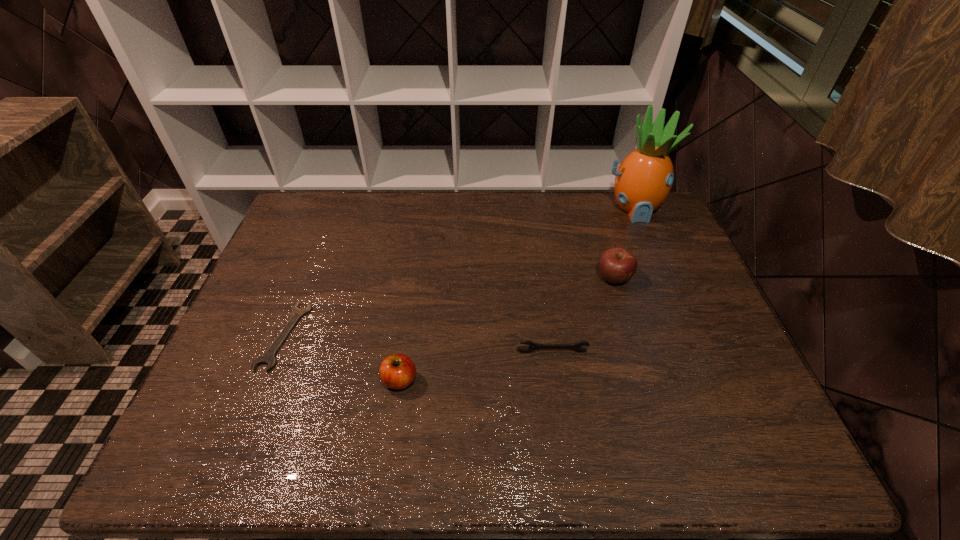
Image resolution: width=960 pixels, height=540 pixels. I want to click on vacant area between the third object from left to right and the second object from left to right, so click(476, 366).

This screenshot has height=540, width=960. What are the coordinates of `vacant space that is in between the farthest object and the second shortest object` in the screenshot? It's located at (592, 280).

Identify the location of blank region between the second shortest object and the farthest object. The image size is (960, 540). (592, 280).

This screenshot has width=960, height=540. Find the location of `vacant region between the taller wrench and the leftmost object`. vacant region between the taller wrench and the leftmost object is located at coordinates pyautogui.click(x=418, y=344).

Find the location of `free space between the third object from left to right and the leftmost object`. free space between the third object from left to right and the leftmost object is located at coordinates (418, 344).

You are a GUI agent. You are given a task and a screenshot of the screen. Output one action in this format:
    pyautogui.click(x=<x>, y=<y>)
    Task: Click on the object that can be found as the second closest to the nearer apple
    Image resolution: width=960 pixels, height=540 pixels.
    Given the screenshot: What is the action you would take?
    pyautogui.click(x=533, y=346)

Choose which object is the fourth nearest neighbor to the left apple. Please provide its 2D coordinates. Your answer should be formatted as a tuple, i.e. [(x, y)], where the tuple contains the x and y coordinates of a point satisfying the conditions above.

[(644, 179)]